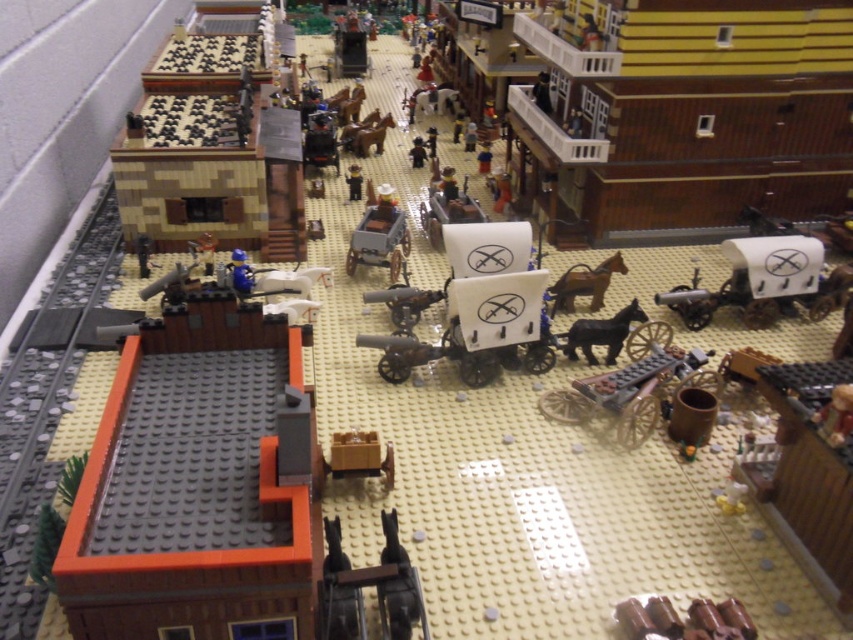
You are a photographer positioned at the back of the Lego diorama. You want to take a photo of both the smooth brown cowboy hat at center and the matte black figure at center. Which object will appear larger in your photo?

The smooth brown cowboy hat at center will appear larger in the photo because it is closer to the viewer than the matte black figure at center.